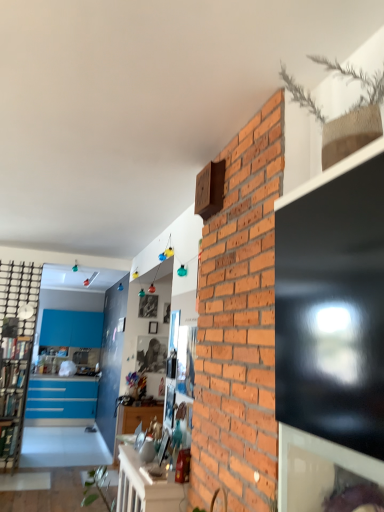
Question: Considering the positions of white glossy table at lower center and black metal bookshelf at left in the image, is white glossy table at lower center bigger or smaller than black metal bookshelf at left?

Choices:
 (A) big
 (B) small

Answer: (A)

Question: Is point (162, 487) positioned closer to the camera than point (19, 336)?

Choices:
 (A) closer
 (B) farther

Answer: (A)

Question: From their relative heights in the image, would you say white glossy table at lower center is taller or shorter than black metal bookshelf at left?

Choices:
 (A) short
 (B) tall

Answer: (A)

Question: Relative to white glossy table at lower center, is black metal bookshelf at left in front or behind?

Choices:
 (A) front
 (B) behind

Answer: (B)

Question: Visually, is black metal bookshelf at left positioned to the left or to the right of white glossy table at lower center?

Choices:
 (A) left
 (B) right

Answer: (A)

Question: Looking at the image, does black metal bookshelf at left seem bigger or smaller compared to white glossy table at lower center?

Choices:
 (A) small
 (B) big

Answer: (A)

Question: From the image's perspective, is black metal bookshelf at left above or below white glossy table at lower center?

Choices:
 (A) below
 (B) above

Answer: (B)